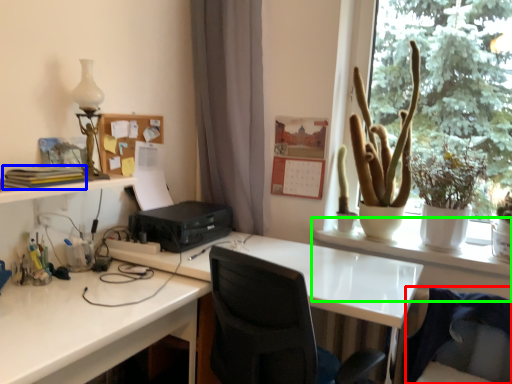
Question: Estimate the real-world distances between objects in this image. Which object is closer to swivel chair (highlighted by a red box), book (highlighted by a blue box) or table (highlighted by a green box)?

Choices:
 (A) book
 (B) table

Answer: (B)